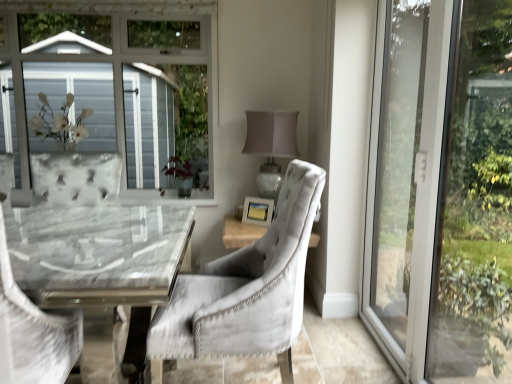
You are a GUI agent. You are given a task and a screenshot of the screen. Output one action in this format:
    pyautogui.click(x=<x>, y=<y>)
    Task: Click on the green matte plant at center
    The height and width of the screenshot is (384, 512).
    Given the screenshot: What is the action you would take?
    pyautogui.click(x=181, y=174)

What do you see at coordinates (271, 145) in the screenshot?
I see `matte gray lampshade at upper right` at bounding box center [271, 145].

Measure the distance between point (x=36, y=316) and camera.

A distance of 4.07 feet exists between point (x=36, y=316) and camera.

Find the location of a particular element. transparent glass door at right is located at coordinates (441, 191).

The width and height of the screenshot is (512, 384). What do you see at coordinates (246, 286) in the screenshot? I see `velvet grey chair at center, arranged as the 1th chair when viewed from the right` at bounding box center [246, 286].

The width and height of the screenshot is (512, 384). Identify the location of green matte plant at center. (181, 174).

Between matte gray lampshade at upper right and velvet gray chair at left, marked as the 2th chair in a right-to-left arrangement, which one has larger size?

velvet gray chair at left, marked as the 2th chair in a right-to-left arrangement.

Can you confirm if matte gray lampshade at upper right is wider than velvet gray chair at left, which appears as the first chair when viewed from the left?

No, matte gray lampshade at upper right is not wider than velvet gray chair at left, which appears as the first chair when viewed from the left.

The height and width of the screenshot is (384, 512). I want to click on the 1st chair positioned below the matte gray lampshade at upper right (from a real-world perspective), so click(x=31, y=321).

Considering the relative sizes of matte wooden picture frame at center and velvet gray chair at left, marked as the 2th chair in a right-to-left arrangement, in the image provided, is matte wooden picture frame at center smaller than velvet gray chair at left, marked as the 2th chair in a right-to-left arrangement,?

Correct, matte wooden picture frame at center occupies less space than velvet gray chair at left, marked as the 2th chair in a right-to-left arrangement.

Considering the positions of objects matte wooden picture frame at center and velvet gray chair at left, marked as the 2th chair in a right-to-left arrangement, in the image provided, who is more to the left, matte wooden picture frame at center or velvet gray chair at left, marked as the 2th chair in a right-to-left arrangement,?

From the viewer's perspective, velvet gray chair at left, marked as the 2th chair in a right-to-left arrangement, appears more on the left side.

Can you confirm if matte wooden picture frame at center is bigger than transparent glass door at right?

Actually, matte wooden picture frame at center might be smaller than transparent glass door at right.

Is matte wooden picture frame at center directly adjacent to transparent glass door at right?

matte wooden picture frame at center and transparent glass door at right are not in contact.

What's the angular difference between matte wooden picture frame at center and transparent glass door at right's facing directions?

The angle between the facing direction of matte wooden picture frame at center and the facing direction of transparent glass door at right is 54 degrees.

From the image's perspective, is matte wooden picture frame at center on transparent glass door at right?

No, from the image's perspective, matte wooden picture frame at center is not above transparent glass door at right.

Which of these two, matte wooden picture frame at center or matte gray lampshade at upper right, is wider?

With larger width is matte gray lampshade at upper right.

Image resolution: width=512 pixels, height=384 pixels. In order to click on table lamp in front of the matte wooden picture frame at center in this screenshot , I will do `click(271, 145)`.

Is matte gray lampshade at upper right surrounded by matte wooden picture frame at center?

No, matte gray lampshade at upper right is not a part of matte wooden picture frame at center.

Can you confirm if matte wooden picture frame at center is shorter than matte gray lampshade at upper right?

Indeed, matte wooden picture frame at center has a lesser height compared to matte gray lampshade at upper right.

The height and width of the screenshot is (384, 512). Find the location of `table lamp in front of the green matte plant at center`. table lamp in front of the green matte plant at center is located at coordinates (271, 145).

Is point (186, 181) more distant than point (254, 130)?

Yes, it is.

Is green matte plant at center touching matte gray lampshade at upper right?

No, green matte plant at center is not making contact with matte gray lampshade at upper right.

Consider the image. How different are the orientations of green matte plant at center and matte gray lampshade at upper right in degrees?

0.000151 degrees separate the facing orientations of green matte plant at center and matte gray lampshade at upper right.

From the image's perspective, is velvet grey chair at center, which appears as the second chair when viewed from the left, under velvet gray chair at left, marked as the 2th chair in a right-to-left arrangement?

Actually, velvet grey chair at center, which appears as the second chair when viewed from the left, appears above velvet gray chair at left, marked as the 2th chair in a right-to-left arrangement, in the image.

Consider the image. Is velvet grey chair at center, which appears as the second chair when viewed from the left, located outside velvet gray chair at left, marked as the 2th chair in a right-to-left arrangement?

Absolutely, velvet grey chair at center, which appears as the second chair when viewed from the left, is external to velvet gray chair at left, marked as the 2th chair in a right-to-left arrangement.

In the image, there is a velvet grey chair at center, arranged as the 1th chair when viewed from the right. Where is `chair below it (from the image's perspective)`? This screenshot has height=384, width=512. chair below it (from the image's perspective) is located at coordinates (31, 321).

Consider the image. Which of these two, transparent glass door at right or velvet grey chair at center, arranged as the 1th chair when viewed from the right, is thinner?

transparent glass door at right is thinner.

Can you see transparent glass door at right touching velvet grey chair at center, which appears as the second chair when viewed from the left?

No, transparent glass door at right is not in contact with velvet grey chair at center, which appears as the second chair when viewed from the left.

Who is more distant, transparent glass door at right or velvet grey chair at center, which appears as the second chair when viewed from the left?

velvet grey chair at center, which appears as the second chair when viewed from the left, is further from the camera.

Could you tell me if transparent glass door at right is facing velvet grey chair at center, arranged as the 1th chair when viewed from the right?

Yes, transparent glass door at right faces towards velvet grey chair at center, arranged as the 1th chair when viewed from the right.

Locate an element on the screen. the 2nd chair in front of the matte gray lampshade at upper right, starting your count from the anchor is located at coordinates (31, 321).

There is a matte wooden picture frame at center. Where is `the 2nd chair below it (from the image's perspective)`? Image resolution: width=512 pixels, height=384 pixels. the 2nd chair below it (from the image's perspective) is located at coordinates (31, 321).

From the image, which object appears to be farther from matte wooden picture frame at center, velvet grey chair at center, arranged as the 1th chair when viewed from the right, or transparent glass door at right?

velvet grey chair at center, arranged as the 1th chair when viewed from the right.

From the image, which object appears to be farther from velvet grey chair at center, which appears as the second chair when viewed from the left, matte wooden picture frame at center or transparent glass door at right?

The object further to velvet grey chair at center, which appears as the second chair when viewed from the left, is matte wooden picture frame at center.

Considering their positions, is velvet grey chair at center, which appears as the second chair when viewed from the left, positioned closer to transparent glass door at right than matte gray lampshade at upper right?

Based on the image, velvet grey chair at center, which appears as the second chair when viewed from the left, appears to be nearer to transparent glass door at right.

From the image, which object appears to be farther from velvet grey chair at center, arranged as the 1th chair when viewed from the right, transparent glass door at right or velvet gray chair at left, which appears as the first chair when viewed from the left?

The object further to velvet grey chair at center, arranged as the 1th chair when viewed from the right, is transparent glass door at right.

In the scene shown: From the image, which object appears to be nearer to transparent glass door at right, matte wooden picture frame at center or velvet gray chair at left, marked as the 2th chair in a right-to-left arrangement?

The object closer to transparent glass door at right is matte wooden picture frame at center.

Which object lies nearer to the anchor point velvet grey chair at center, arranged as the 1th chair when viewed from the right, matte gray lampshade at upper right or velvet gray chair at left, marked as the 2th chair in a right-to-left arrangement?

Among the two, velvet gray chair at left, marked as the 2th chair in a right-to-left arrangement, is located nearer to velvet grey chair at center, arranged as the 1th chair when viewed from the right.

From the image, which object appears to be farther from matte gray lampshade at upper right, green matte plant at center or transparent glass door at right?

transparent glass door at right.

Estimate the real-world distances between objects in this image. Which object is closer to matte wooden picture frame at center, matte gray lampshade at upper right or green matte plant at center?

matte gray lampshade at upper right lies closer to matte wooden picture frame at center than the other object.

At what (x,y) coordinates should I click in order to perform the action: click on picture frame positioned between transparent glass door at right and green matte plant at center from near to far. Please return your answer as a coordinate pair (x, y). The image size is (512, 384). Looking at the image, I should click on (258, 211).

Identify the location of picture frame between green matte plant at center and matte gray lampshade at upper right. (258, 211).

Where is `window positioned between velvet gray chair at left, marked as the 2th chair in a right-to-left arrangement, and green matte plant at center from near to far`? window positioned between velvet gray chair at left, marked as the 2th chair in a right-to-left arrangement, and green matte plant at center from near to far is located at coordinates (441, 191).

What are the coordinates of `chair located between transparent glass door at right and green matte plant at center in the depth direction` in the screenshot? It's located at (246, 286).